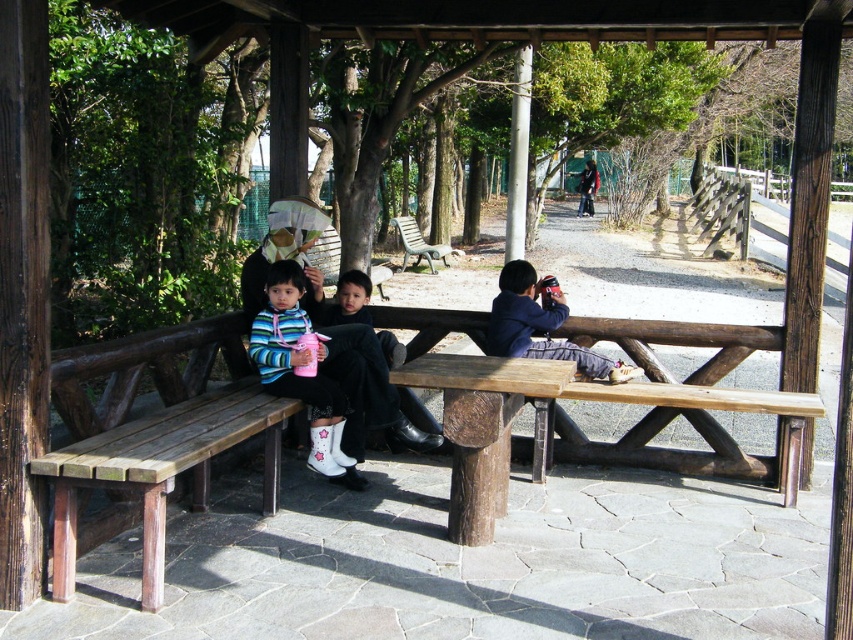
Is point (265, 456) positioned behind point (509, 340)?

That is False.

Who is higher up, wooden bench at center or blue cotton shirt at center?

Positioned higher is blue cotton shirt at center.

Identify the location of wooden bench at center. (154, 436).

Who is higher up, striped fabric sweater at center or green plastic bench at center?

green plastic bench at center is above.

This screenshot has height=640, width=853. Describe the element at coordinates (350, 300) in the screenshot. I see `striped fabric sweater at center` at that location.

Find the location of `striped fabric sweater at center`. striped fabric sweater at center is located at coordinates (350, 300).

Who is shorter, rustic wood picnic table at center or blue cotton shirt at center?

With less height is blue cotton shirt at center.

Is point (467, 486) closer to viewer compared to point (552, 339)?

That is True.

This screenshot has height=640, width=853. I want to click on rustic wood picnic table at center, so click(485, 428).